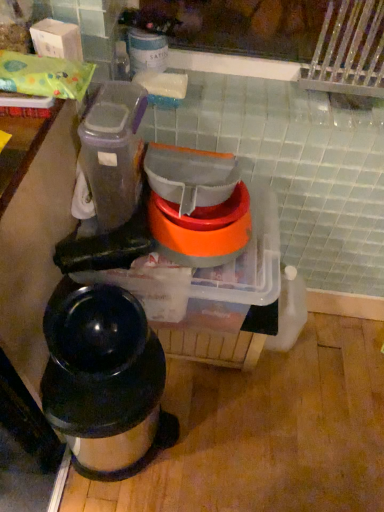
Where is `free point above shiny black thermos at lower left (from a real-world perspective)`? The width and height of the screenshot is (384, 512). free point above shiny black thermos at lower left (from a real-world perspective) is located at coordinates (101, 393).